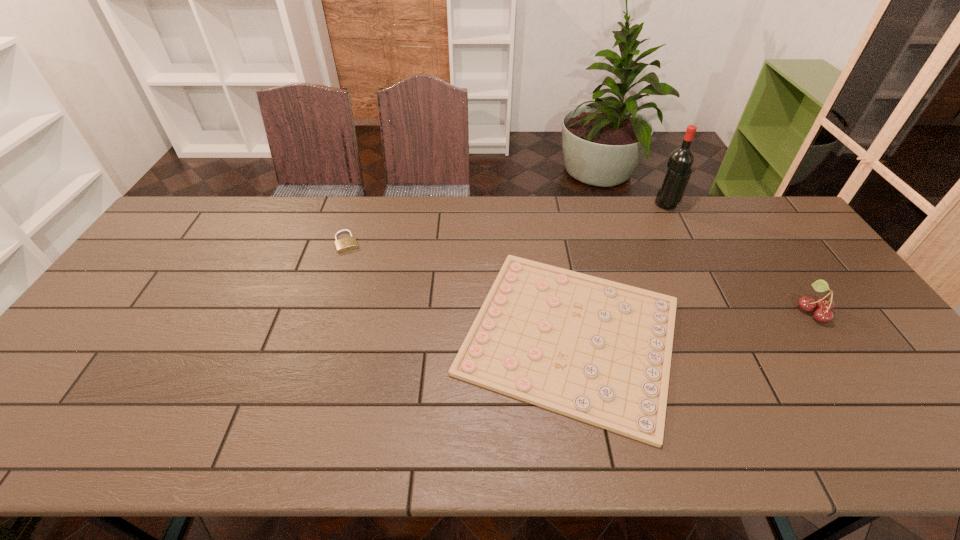
Identify the location of vacant space at the right edge of the desktop. The width and height of the screenshot is (960, 540). (796, 297).

In the image, there is a desktop. Where is `vacant space at the far left corner`? The width and height of the screenshot is (960, 540). vacant space at the far left corner is located at coordinates (181, 214).

Locate an element on the screen. This screenshot has width=960, height=540. free space at the near right corner of the desktop is located at coordinates (953, 427).

Where is `free space between the padlock and the wine bottle`? free space between the padlock and the wine bottle is located at coordinates 507,224.

Identify the location of free area in between the cherry and the wine bottle. This screenshot has height=540, width=960. (739, 258).

This screenshot has height=540, width=960. Find the location of `free space between the rightmost object and the gameboard`. free space between the rightmost object and the gameboard is located at coordinates (691, 323).

Where is `free space between the gameboard and the third nearest object`? free space between the gameboard and the third nearest object is located at coordinates (459, 289).

The width and height of the screenshot is (960, 540). I want to click on vacant area that lies between the wine bottle and the third nearest object, so click(x=507, y=224).

Image resolution: width=960 pixels, height=540 pixels. Identify the location of empty space that is in between the second tallest object and the shortest object. (691, 323).

Image resolution: width=960 pixels, height=540 pixels. Find the location of `vacant space in between the third shortest object and the shortest object`. vacant space in between the third shortest object and the shortest object is located at coordinates (691, 323).